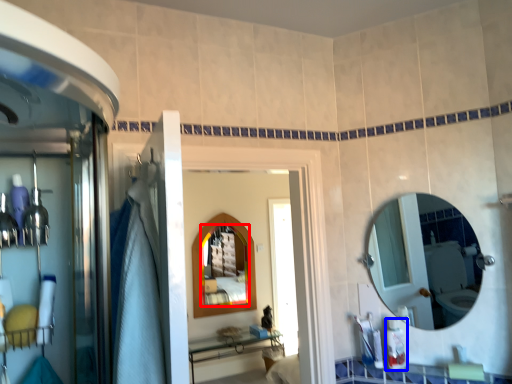
Question: Among these objects, which one is nearest to the camera, mirror (highlighted by a red box) or toiletry (highlighted by a blue box)?

Choices:
 (A) mirror
 (B) toiletry

Answer: (B)